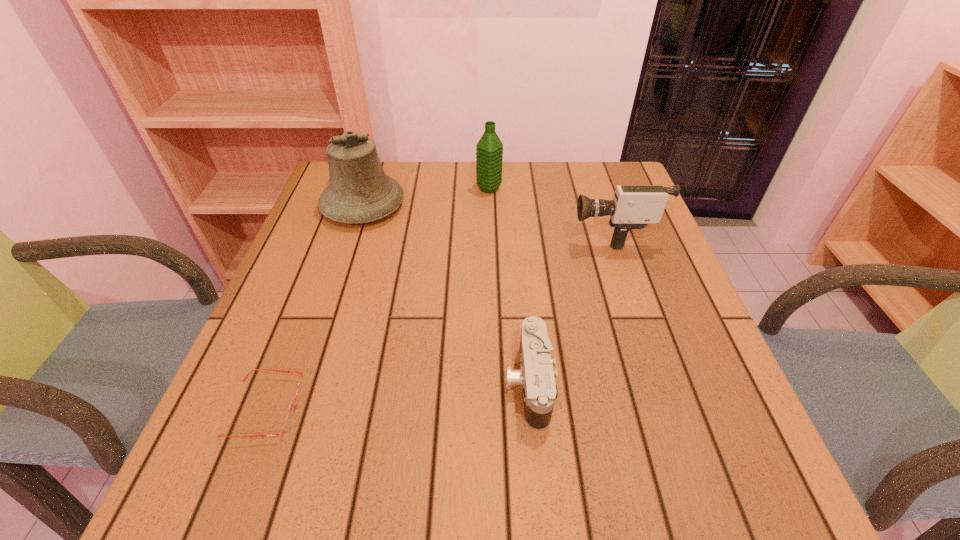
Where is `vacant area between the spectacles and the camcorder`? Image resolution: width=960 pixels, height=540 pixels. vacant area between the spectacles and the camcorder is located at coordinates (439, 321).

Identify the location of vacant area that lies between the spectacles and the bell. The width and height of the screenshot is (960, 540). (315, 307).

Locate an element on the screen. The width and height of the screenshot is (960, 540). vacant space that is in between the second shortest object and the spectacles is located at coordinates (397, 395).

Locate an element on the screen. empty location between the rightmost object and the shortest object is located at coordinates (439, 321).

Find the location of `vacant area that lies between the water bottle and the second shortest object`. vacant area that lies between the water bottle and the second shortest object is located at coordinates (509, 286).

Find the location of a particular element. The height and width of the screenshot is (540, 960). unoccupied position between the bell and the shortest object is located at coordinates (315, 307).

Identify which object is the third closest to the spectacles. Please provide its 2D coordinates. Your answer should be formatted as a tuple, i.e. [(x, y)], where the tuple contains the x and y coordinates of a point satisfying the conditions above.

[(634, 206)]

Identify the location of the fourth closest object to the water bottle. The width and height of the screenshot is (960, 540). (290, 415).